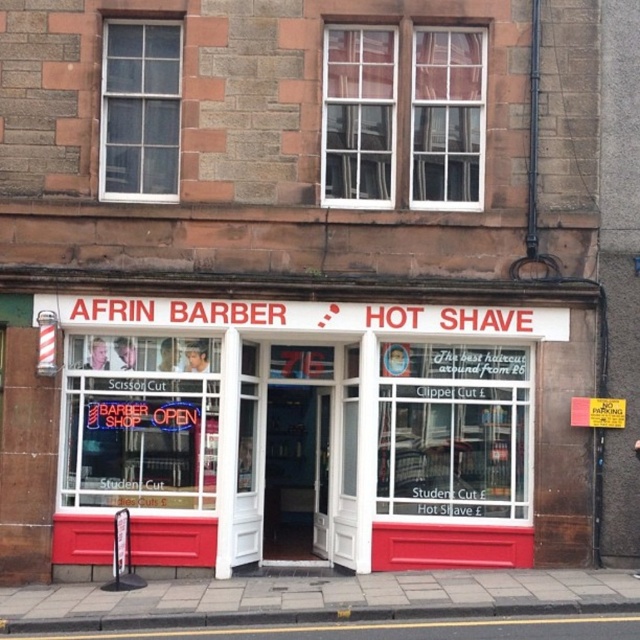
Can you confirm if matte glass storefront at center is positioned below concrete at lower center?

Incorrect, matte glass storefront at center is not positioned below concrete at lower center.

Who is positioned more to the left, matte glass storefront at center or concrete at lower center?

From the viewer's perspective, matte glass storefront at center appears more on the left side.

Locate an element on the screen. matte glass storefront at center is located at coordinates (241, 358).